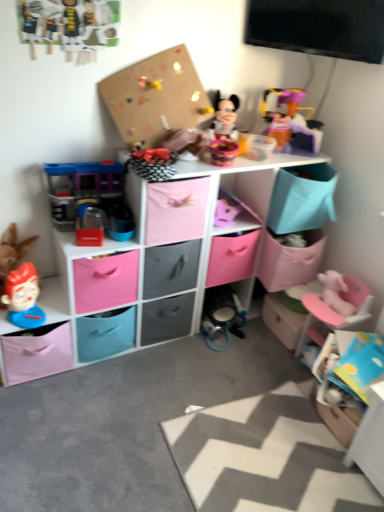
Where is `vacant region to the left of pink plastic swivel chair at lower right`? vacant region to the left of pink plastic swivel chair at lower right is located at coordinates (266, 360).